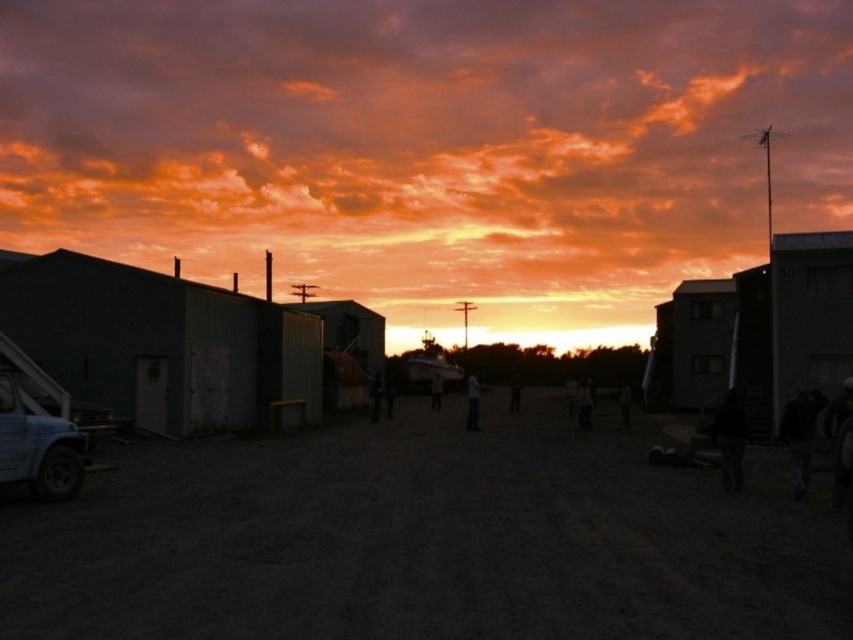
Question: Which point is closer to the camera?

Choices:
 (A) smooth gray hut at center
 (B) metallic corrugated hut at center
 (C) dark gray jacket at center

Answer: (B)

Question: Which point is closer to the camera?

Choices:
 (A) dark fabric bag at center
 (B) dark gray fabric jacket at lower right
 (C) dark fabric person at center

Answer: (B)

Question: Estimate the real-world distances between objects in this image. Which object is closer to the metallic gray hut at left?

Choices:
 (A) orange sky at upper center
 (B) dark gray fabric jacket at lower right
 (C) dark fabric person at center
 (D) metallic corrugated hut at center

Answer: (D)

Question: Does dark brown dirt track at center come in front of dark fabric jacket at center?

Choices:
 (A) yes
 (B) no

Answer: (A)

Question: Does dark fabric person at center appear on the right side of dark gray jacket at center?

Choices:
 (A) no
 (B) yes

Answer: (B)

Question: Can you confirm if orange sky at upper center is smaller than smooth gray hut at center?

Choices:
 (A) yes
 (B) no

Answer: (B)